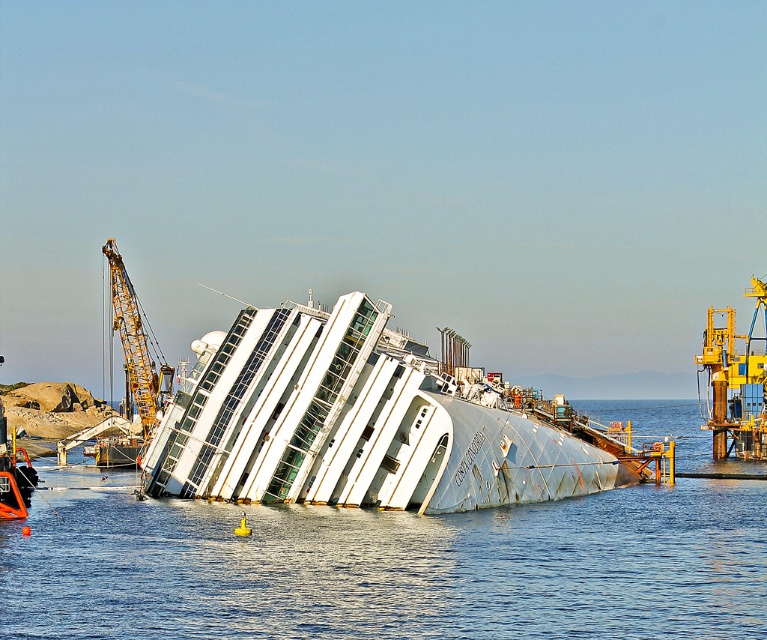
Which is more to the left, clear blue water at center or white metallic ship at center?

From the viewer's perspective, white metallic ship at center appears more on the left side.

Can you confirm if clear blue water at center is bigger than white metallic ship at center?

Indeed, clear blue water at center has a larger size compared to white metallic ship at center.

Does point (287, 512) lie behind point (254, 433)?

No, (287, 512) is in front of (254, 433).

Locate an element on the screen. clear blue water at center is located at coordinates (387, 566).

Can you confirm if clear blue water at center is wider than yellow metallic crane at upper left?

Indeed, clear blue water at center has a greater width compared to yellow metallic crane at upper left.

Locate an element on the screen. This screenshot has width=767, height=640. clear blue water at center is located at coordinates (387, 566).

At what (x,y) coordinates should I click in order to perform the action: click on clear blue water at center. Please return your answer as a coordinate pair (x, y). This screenshot has width=767, height=640. Looking at the image, I should click on (387, 566).

I want to click on clear blue water at center, so click(387, 566).

Between white metallic ship at center and yellow metallic crane at upper left, which one appears on the left side from the viewer's perspective?

From the viewer's perspective, yellow metallic crane at upper left appears more on the left side.

Which is in front, point (212, 422) or point (127, 385)?

Point (212, 422)

This screenshot has width=767, height=640. I want to click on white metallic ship at center, so click(351, 422).